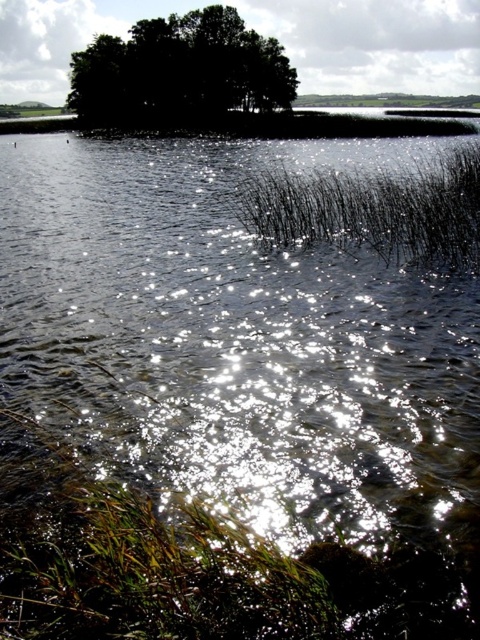
Is black matte reed at center positioned behind dark green leafy trees at upper center?

No, it is in front of dark green leafy trees at upper center.

Does point (467, 268) come in front of point (87, 65)?

Yes, it is in front of point (87, 65).

This screenshot has height=640, width=480. Describe the element at coordinates (372, 211) in the screenshot. I see `black matte reed at center` at that location.

Identify the location of black matte reed at center. (372, 211).